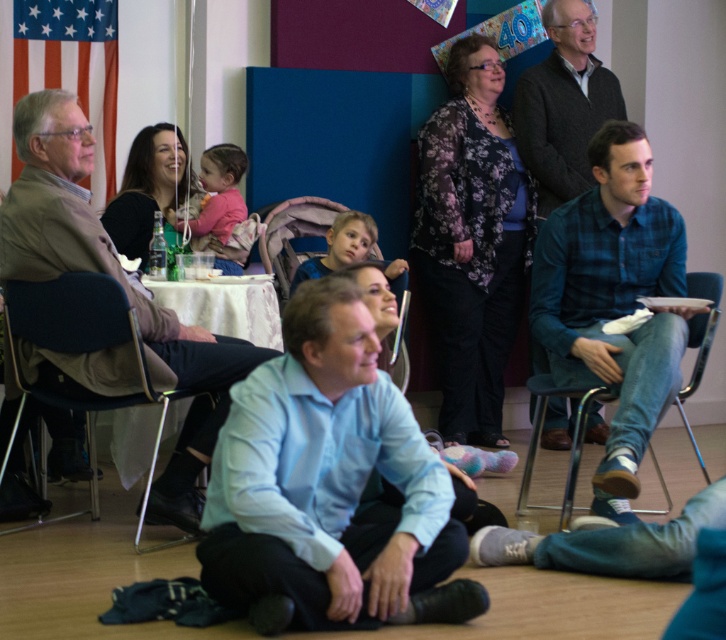
You are a photographer at the event and want to take a photo of the matte plastic chair at center without the matte brown jacket at left blocking it. What should you do?

Move the matte brown jacket at left behind the matte plastic chair at center since the matte brown jacket at left is currently in front of the matte plastic chair at center.

You are organizing a photo shoot and need to ensure that all subjects are visible in the frame. Given the blue plaid shirt at center and the metallic silver chair at lower left, which object should you prioritize positioning closer to the camera to maintain clarity?

The blue plaid shirt at center should be positioned closer to the camera because it is larger in size compared to the metallic silver chair at lower left, ensuring both objects are clearly visible in the frame.

You are standing at the entrance of the room and want to move to the back wall. There are two chairs in your way, the metallic blue chair at right and the matte plastic chair at center. Which chair do you need to go around first?

The metallic blue chair at right is in front of the matte plastic chair at center, so you need to go around the metallic blue chair at right first before reaching the matte plastic chair at center.